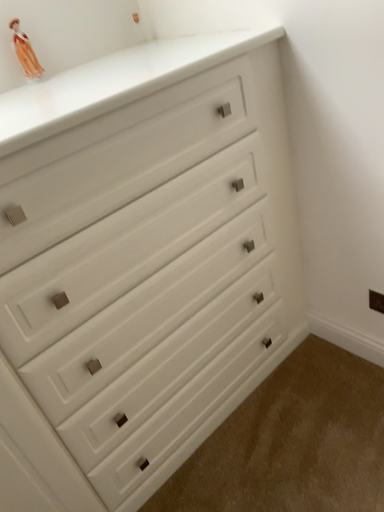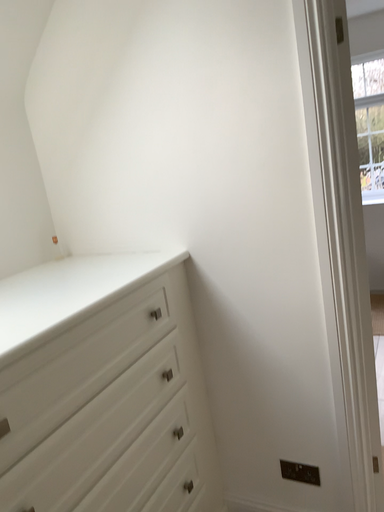
Question: How did the camera likely rotate when shooting the video?

Choices:
 (A) rotated right
 (B) rotated left

Answer: (A)